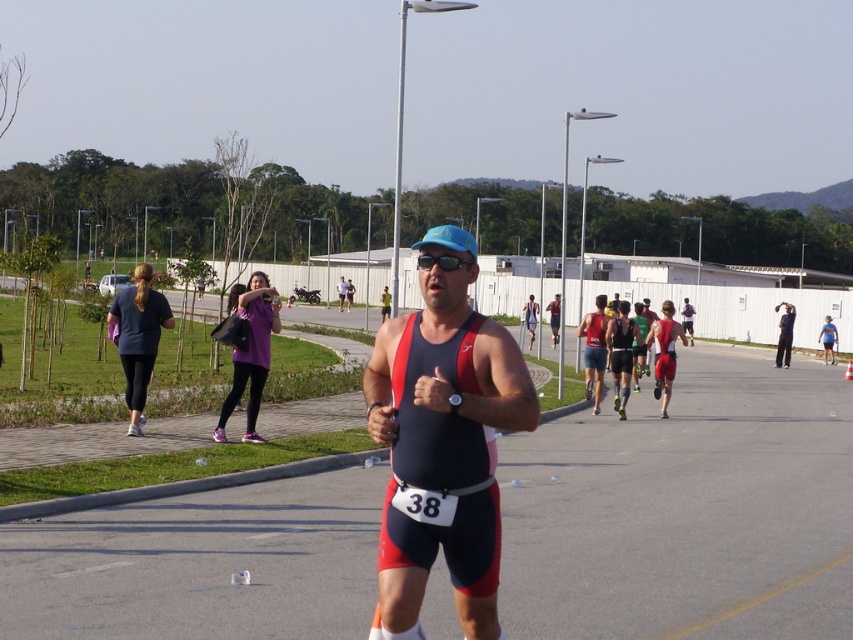
You are a photographer at the triathlon event. You need to capture a photo of the athlete in the matte red and black triathlon suit at center and the purple fabric bag at upper left in the same frame. Based on their sizes, which object will appear larger in the photo?

The matte red and black triathlon suit at center will appear larger in the photo because its width surpasses that of the purple fabric bag at upper left.

You are a photographer standing next to a camera. You want to capture a closeup shot of the dark blue fabric running suit at left. Based on the scene, can you determine if you can get a clear closeup shot without moving the camera?

The dark blue fabric running suit at left and camera are 13.98 meters apart from each other. Since 13.98 meters is a considerable distance, it would be challenging to capture a clear closeup shot without moving the camera closer.

You are a photographer at the triathlon event and want to capture a photo of both the dark blue fabric running suit at left and the purple fabric bag at upper left in the same frame. Based on their positions, which object should you focus on first to ensure both are in the shot?

The dark blue fabric running suit at left is positioned on the left side of the purple fabric bag at upper left. To capture both in the same frame, you should focus on the dark blue fabric running suit at left first since it is closer to the left edge, ensuring the purple fabric bag at upper left remains within the frame.